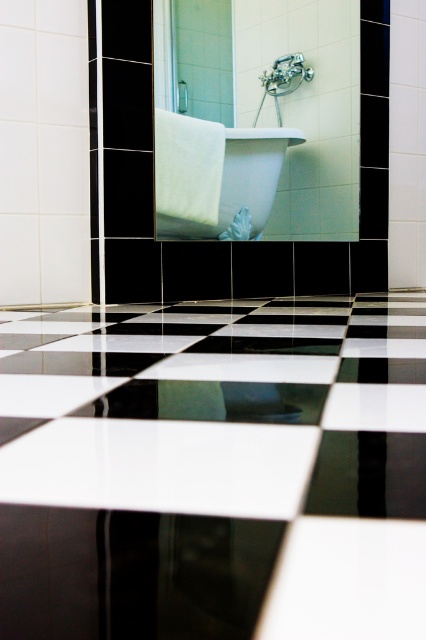
Question: Is white glossy bathtub at center to the left of matte silver shower head at upper center from the viewer's perspective?

Choices:
 (A) yes
 (B) no

Answer: (A)

Question: Is white glossy bathtub at center positioned before matte silver shower head at upper center?

Choices:
 (A) yes
 (B) no

Answer: (A)

Question: Does white glossy bathtub at center come behind matte silver shower head at upper center?

Choices:
 (A) no
 (B) yes

Answer: (A)

Question: Which of the following is the closest to the observer?

Choices:
 (A) matte silver shower head at upper center
 (B) white glossy bathtub at center

Answer: (B)